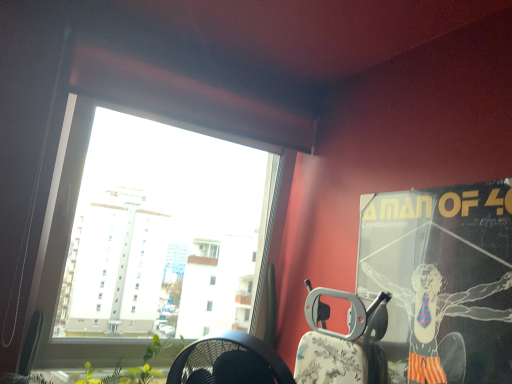
Question: Is matte black poster at upper right bigger or smaller than metallic silver armchair at right?

Choices:
 (A) small
 (B) big

Answer: (B)

Question: From the image's perspective, is matte black poster at upper right positioned above or below metallic silver armchair at right?

Choices:
 (A) above
 (B) below

Answer: (A)

Question: Does point (457, 370) appear closer or farther from the camera than point (356, 377)?

Choices:
 (A) closer
 (B) farther

Answer: (A)

Question: Considering the positions of metallic silver armchair at right and matte black poster at upper right in the image, is metallic silver armchair at right taller or shorter than matte black poster at upper right?

Choices:
 (A) tall
 (B) short

Answer: (B)

Question: Visually, is metallic silver armchair at right positioned to the left or to the right of matte black poster at upper right?

Choices:
 (A) right
 (B) left

Answer: (B)

Question: In terms of size, does metallic silver armchair at right appear bigger or smaller than matte black poster at upper right?

Choices:
 (A) big
 (B) small

Answer: (B)

Question: Is metallic silver armchair at right spatially inside matte black poster at upper right, or outside of it?

Choices:
 (A) inside
 (B) outside

Answer: (B)